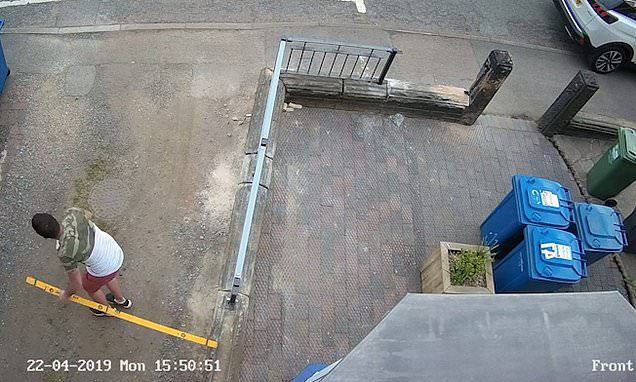
You are a GUI agent. You are given a task and a screenshot of the screen. Output one action in this format:
    pyautogui.click(x=<x>, y=<y>)
    Task: Click on the green trash can
    The height and width of the screenshot is (382, 636).
    Given the screenshot: What is the action you would take?
    pyautogui.click(x=616, y=160)